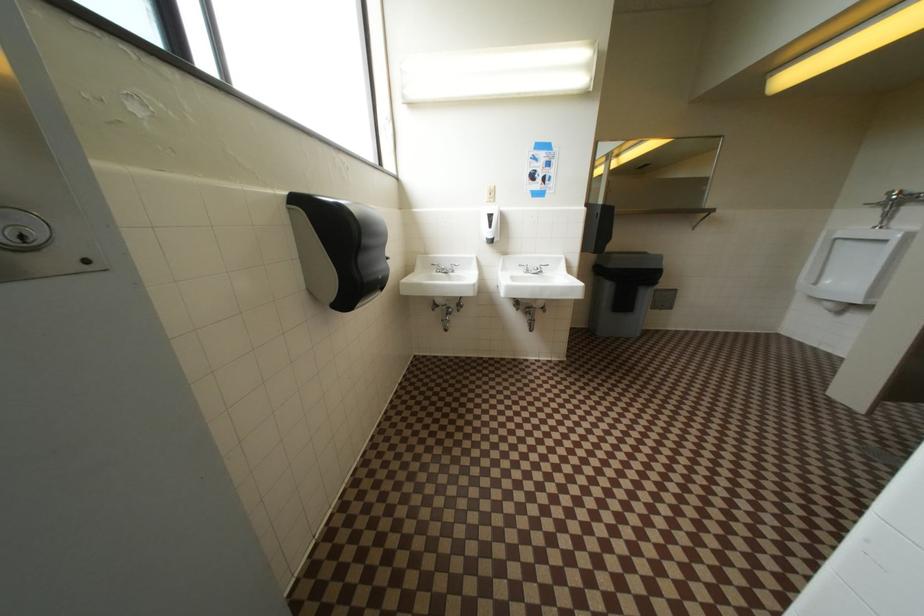
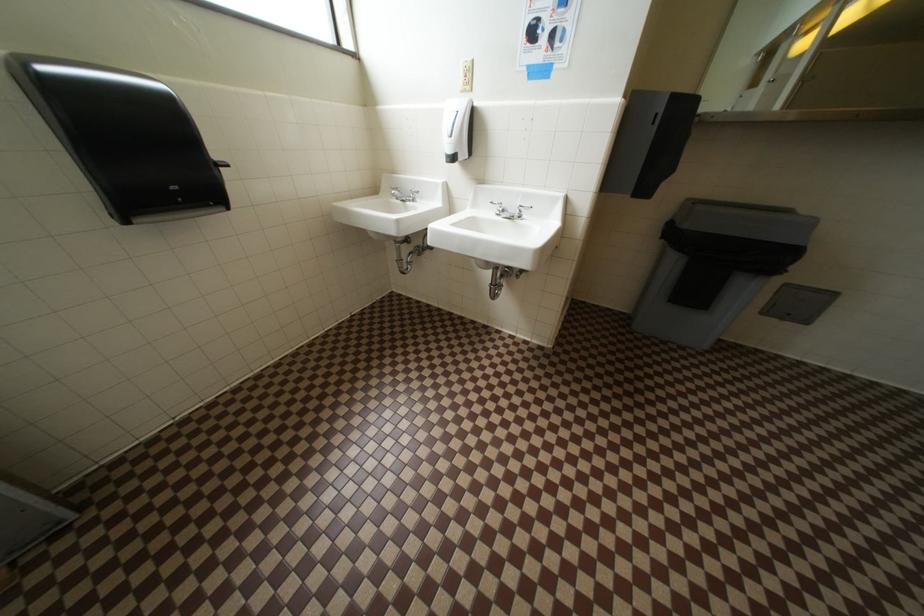
The images are taken continuously from a first-person perspective. In which direction are you moving?

The cameraman moved toward right, forward.